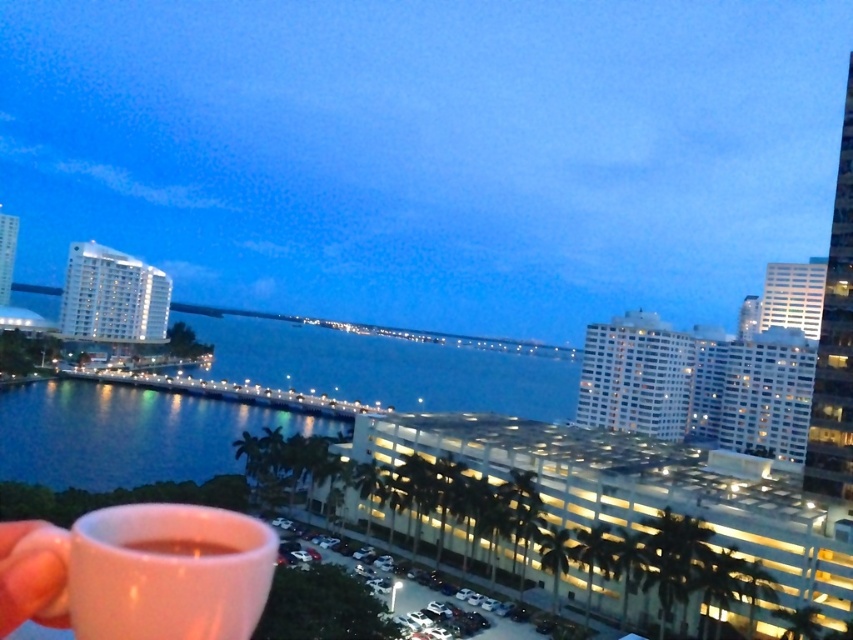
You are an architect evaluating the waterfront view from a new apartment. The apartment has a window facing the blue water at center and the white glossy building at upper left. Which object in the view appears bigger?

The blue water at center appears bigger than the white glossy building at upper left because the blue water at center has a larger size compared to white glossy building at upper left.

You are an architect evaluating the proportions of the white glossy building at upper left and the pink matte cup at lower left in the evening scene. Based on their relative sizes, which object appears larger in the image?

The white glossy building at upper left appears larger than the pink matte cup at lower left because it is taller than the cup.

You are standing at the waterfront and see the white glossy building at upper left and the pink matte cup at lower left. Which object is positioned more to the left side of the image?

The white glossy building at upper left is positioned more to the left side of the image compared to the pink matte cup at lower left.